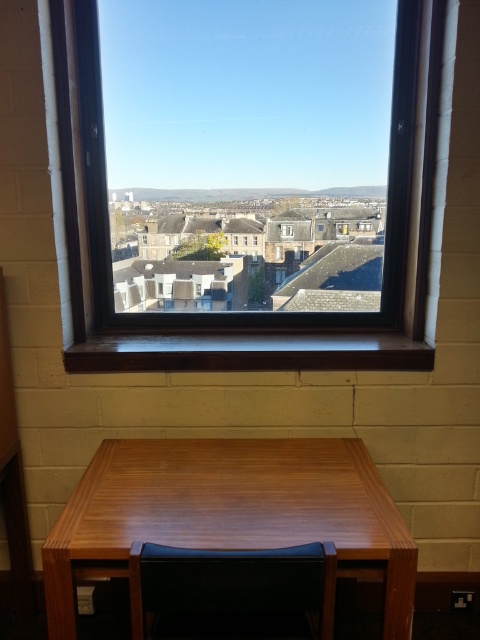
Can you confirm if black leather chair at lower center is wider than clear glass window at center?

Correct, the width of black leather chair at lower center exceeds that of clear glass window at center.

Which is more to the left, black leather chair at lower center or clear glass window at center?

From the viewer's perspective, black leather chair at lower center appears more on the left side.

Which is in front, point (324, 624) or point (286, 234)?

Point (324, 624) is more forward.

Identify the location of black leather chair at lower center. The image size is (480, 640). (231, 593).

Is dark wood frame at center in front of clear glass window at center?

Yes, it is.

Based on the photo, can you confirm if dark wood frame at center is shorter than clear glass window at center?

Incorrect, dark wood frame at center's height does not fall short of clear glass window at center's.

This screenshot has height=640, width=480. Identify the location of dark wood frame at center. (240, 330).

Which is in front, point (51, 572) or point (283, 234)?

Point (51, 572)

Is point (108, 508) more distant than point (284, 234)?

No.

The height and width of the screenshot is (640, 480). I want to click on wooden table at center, so click(229, 513).